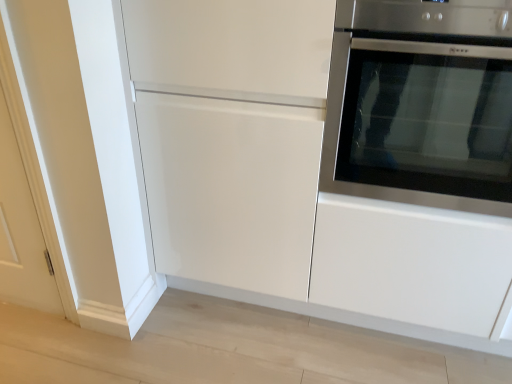
This screenshot has width=512, height=384. What are the coordinates of `stainless steel oven at right` in the screenshot? It's located at (421, 104).

This screenshot has width=512, height=384. What do you see at coordinates (421, 104) in the screenshot? I see `stainless steel oven at right` at bounding box center [421, 104].

Measure the distance between point (x=340, y=12) and camera.

The depth of point (x=340, y=12) is 1.06 meters.

Find the location of `stainless steel oven at right`. stainless steel oven at right is located at coordinates (421, 104).